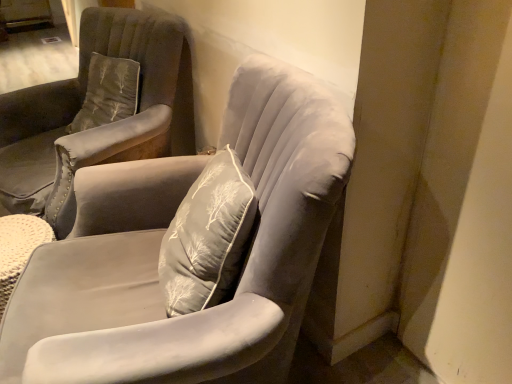
Question: Is velvet gray chair at center, the first chair in the front-to-back sequence, wider or thinner than suede gray armchair at center, marked as the 1th chair in a back-to-front arrangement?

Choices:
 (A) thin
 (B) wide

Answer: (A)

Question: Considering the positions of point (303, 193) and point (50, 132), is point (303, 193) closer or farther from the camera than point (50, 132)?

Choices:
 (A) farther
 (B) closer

Answer: (B)

Question: Is velvet gray chair at center, acting as the 2th chair starting from the back, in front of or behind suede gray armchair at center, marked as the 1th chair in a back-to-front arrangement, in the image?

Choices:
 (A) behind
 (B) front

Answer: (B)

Question: Is suede gray armchair at center, the second chair from the front, bigger or smaller than velvet gray chair at center, the first chair in the front-to-back sequence?

Choices:
 (A) big
 (B) small

Answer: (A)

Question: Is suede gray armchair at center, marked as the 1th chair in a back-to-front arrangement, in front of or behind velvet gray chair at center, the first chair in the front-to-back sequence, in the image?

Choices:
 (A) front
 (B) behind

Answer: (B)

Question: From a real-world perspective, is suede gray armchair at center, the second chair from the front, above or below velvet gray chair at center, the first chair in the front-to-back sequence?

Choices:
 (A) above
 (B) below

Answer: (A)

Question: Based on their positions, is suede gray armchair at center, marked as the 1th chair in a back-to-front arrangement, located to the left or right of velvet gray chair at center, the first chair in the front-to-back sequence?

Choices:
 (A) right
 (B) left

Answer: (B)